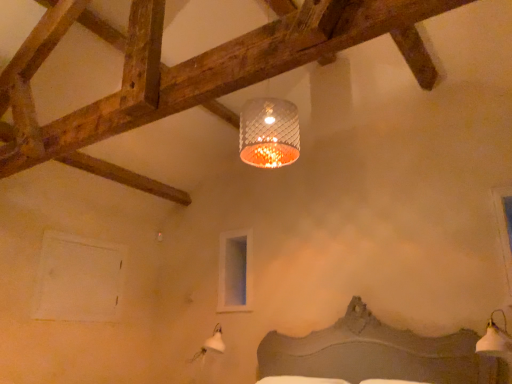
Question: From a real-world perspective, is white glossy lampshade at lower right under clear glass window at upper center, marked as the second window in a left-to-right arrangement?

Choices:
 (A) yes
 (B) no

Answer: (A)

Question: Is white glossy lampshade at lower right positioned far away from clear glass window at upper center, the 1th window in the back-to-front sequence?

Choices:
 (A) no
 (B) yes

Answer: (B)

Question: Considering the relative sizes of white glossy lampshade at lower right and clear glass window at upper center, the third window when ordered from front to back, in the image provided, is white glossy lampshade at lower right wider than clear glass window at upper center, the third window when ordered from front to back,?

Choices:
 (A) yes
 (B) no

Answer: (A)

Question: Is white glossy lampshade at lower right turned away from clear glass window at upper center, which is the 2th window in right-to-left order?

Choices:
 (A) no
 (B) yes

Answer: (A)

Question: Is white glossy lampshade at lower right to the right of clear glass window at upper center, which is the 2th window in right-to-left order, from the viewer's perspective?

Choices:
 (A) no
 (B) yes

Answer: (B)

Question: Based on their positions, is clear glass window at upper center, the 1th window in the back-to-front sequence, located to the left or right of white glossy lampshade at lower right?

Choices:
 (A) left
 (B) right

Answer: (A)

Question: From a real-world perspective, is clear glass window at upper center, which is the 2th window in right-to-left order, physically located above or below white glossy lampshade at lower right?

Choices:
 (A) above
 (B) below

Answer: (A)

Question: From the image's perspective, is clear glass window at upper center, which is the 2th window in right-to-left order, positioned above or below white glossy lampshade at lower right?

Choices:
 (A) below
 (B) above

Answer: (B)

Question: In terms of height, does clear glass window at upper center, which is the 2th window in right-to-left order, look taller or shorter compared to white glossy lampshade at lower right?

Choices:
 (A) tall
 (B) short

Answer: (A)

Question: From a real-world perspective, is transparent glass window at upper right, the third window in the back-to-front sequence, physically located above or below clear glass window at upper center, the third window when ordered from front to back?

Choices:
 (A) above
 (B) below

Answer: (B)

Question: Does point (494, 192) appear closer or farther from the camera than point (220, 253)?

Choices:
 (A) farther
 (B) closer

Answer: (B)

Question: In terms of height, does transparent glass window at upper right, which is the first window from right to left, look taller or shorter compared to clear glass window at upper center, marked as the second window in a left-to-right arrangement?

Choices:
 (A) tall
 (B) short

Answer: (A)

Question: Considering the relative positions of transparent glass window at upper right, which is the first window from right to left, and clear glass window at upper center, marked as the second window in a left-to-right arrangement, in the image provided, is transparent glass window at upper right, which is the first window from right to left, to the left or to the right of clear glass window at upper center, marked as the second window in a left-to-right arrangement,?

Choices:
 (A) left
 (B) right

Answer: (B)

Question: Considering the positions of white matte window at lower left, the second window positioned from the front, and clear glass window at upper center, which is the 2th window in right-to-left order, in the image, is white matte window at lower left, the second window positioned from the front, bigger or smaller than clear glass window at upper center, which is the 2th window in right-to-left order,?

Choices:
 (A) big
 (B) small

Answer: (A)

Question: From their relative heights in the image, would you say white matte window at lower left, placed as the 1th window when sorted from left to right, is taller or shorter than clear glass window at upper center, the third window when ordered from front to back?

Choices:
 (A) tall
 (B) short

Answer: (B)